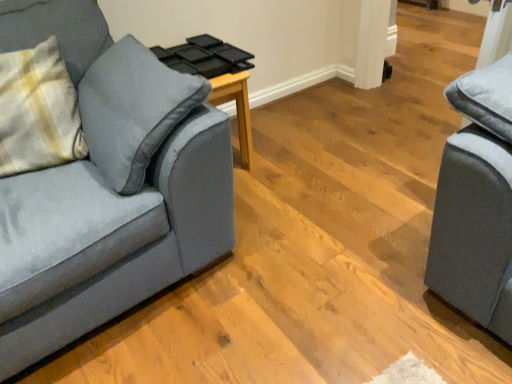
Question: Choose the correct answer: Is plaid fabric pillow at left inside velvet gray couch at left or outside it?

Choices:
 (A) inside
 (B) outside

Answer: (A)

Question: Considering the positions of plaid fabric pillow at left and velvet gray couch at left in the image, is plaid fabric pillow at left taller or shorter than velvet gray couch at left?

Choices:
 (A) short
 (B) tall

Answer: (A)

Question: Based on their relative distances, which object is farther from the wooden side table at center?

Choices:
 (A) velvet gray couch at left
 (B) plaid fabric pillow at left

Answer: (A)

Question: Which of these objects is positioned closest to the plaid fabric pillow at left?

Choices:
 (A) velvet gray couch at left
 (B) wooden side table at center

Answer: (A)